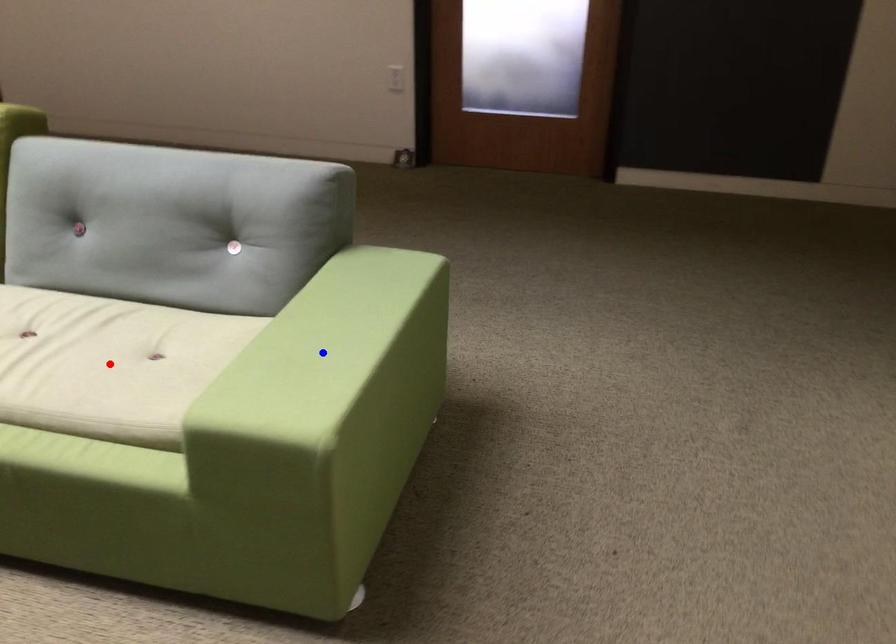
Question: Two points are marked on the image. Which point is closer to the camera?

Choices:
 (A) Blue point is closer.
 (B) Red point is closer.

Answer: (B)